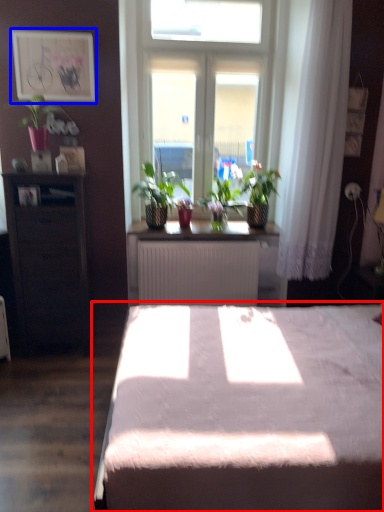
Question: Which object appears closest to the camera in this image, bed (highlighted by a red box) or picture frame (highlighted by a blue box)?

Choices:
 (A) bed
 (B) picture frame

Answer: (A)